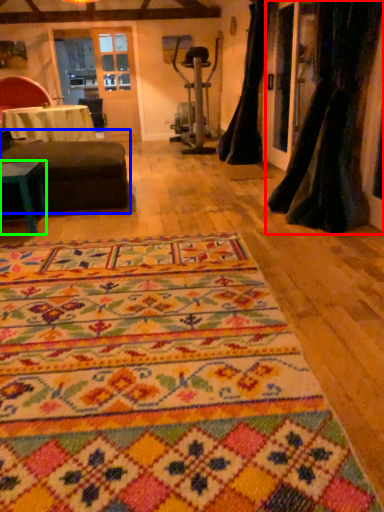
Question: Based on their relative distances, which object is nearer to curtain (highlighted by a red box)? Choose from studio couch (highlighted by a blue box) and table (highlighted by a green box).

Choices:
 (A) studio couch
 (B) table

Answer: (A)